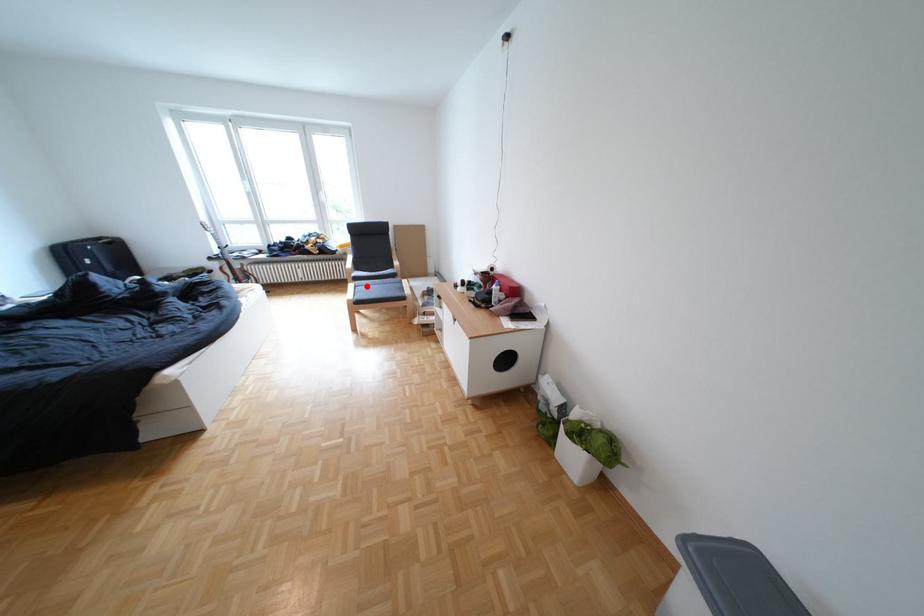
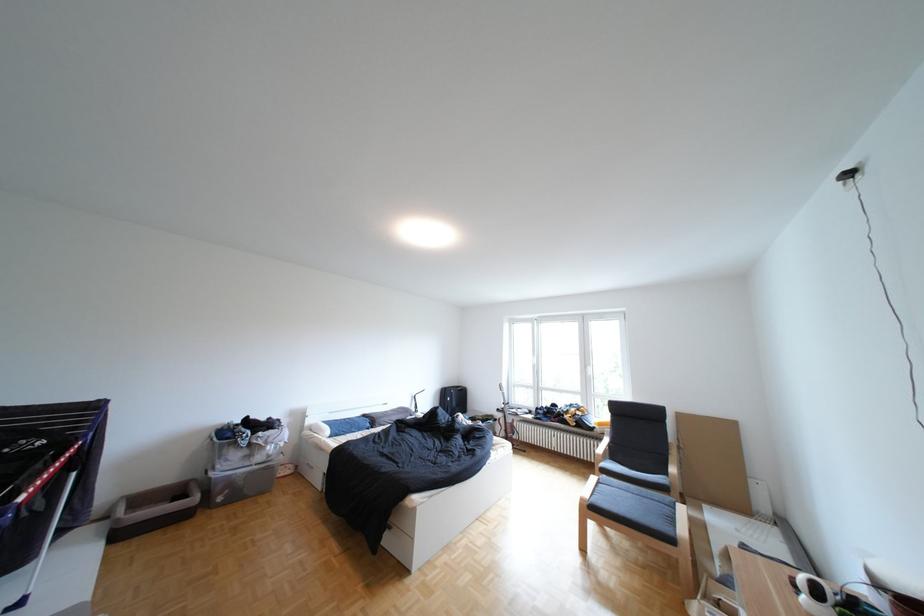
Find the pixel in the second image that matches the highlighted location in the first image.

(610, 479)